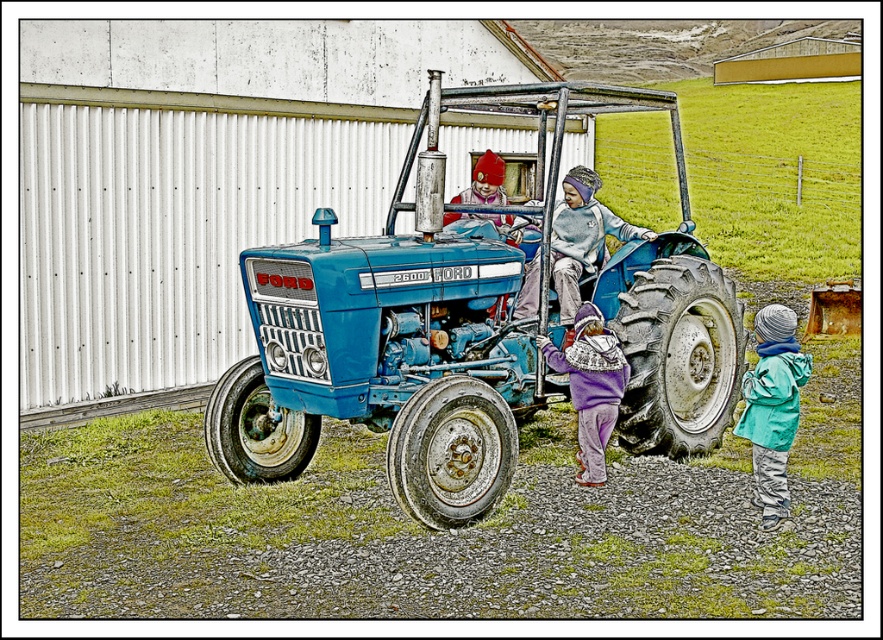
You are a photographer trying to take a clear photo of the blue metallic tractor at center. However, there is a purple fleece jacket at center in the way. Can you still capture the tractor in the photo without the jacket blocking it?

The purple fleece jacket at center is behind the blue metallic tractor at center, so you can take the photo without the jacket blocking the tractor as it is already positioned behind the tractor.

You are a photographer wanting to capture both the teal fabric jacket at lower right and the light blue fleece jacket at center in a single shot. Based on their positions, which jacket should you focus on first to ensure both are in frame?

The teal fabric jacket at lower right is located below the light blue fleece jacket at center. To include both in the frame, focus on the lower area where the teal fabric jacket at lower right is positioned first, then adjust the camera angle to include the light blue fleece jacket at center above it.

You are a photographer trying to capture a candid shot of the two children in their jackets. Since you want to ensure both are visible in the frame, which jacket should you focus on to include both the teal fabric jacket at lower right and the purple fleece jacket at center?

To include both the teal fabric jacket at lower right and the purple fleece jacket at center in the frame, focus on the purple fleece jacket at center because the teal fabric jacket at lower right is positioned below it, making it easier to adjust the camera angle upward to capture both.